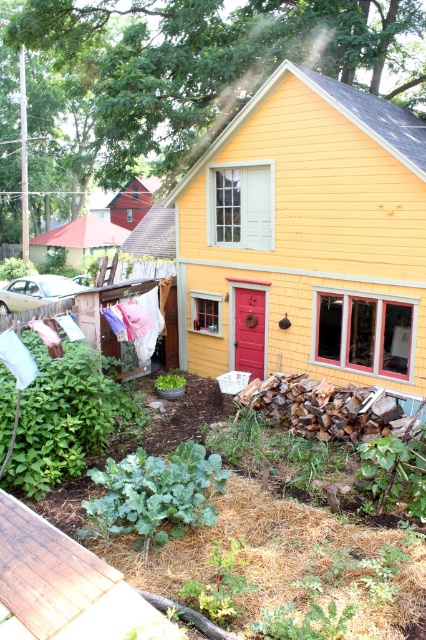
You are planning to move a 1.2 meter wide garden bench into the space between the yellow wood shed at center and the brown wooden deck at lower left. Based on the scene description, will the bench fit in that space?

The yellow wood shed at center is thinner than the brown wooden deck at lower left, so the space between them is at least as wide as the shed. Since the bench is 1.2 meters wide, it depends on the actual width of the shed. However, since the shed is thinner than the deck, the space between them might be sufficient. Without exact measurements, it is uncertain.

You are standing at the front of the house and looking towards the clothesline. There are two points marked on the image, one at coordinates point (275, 77) and another at point (31, 628). Which point is closer to you?

Point (31, 628) is closer to you because it is in front of point (275, 77).

You are a painter who needs to paint both the yellow wood shed at center and the brown wooden deck at lower left. Since you want to save time, which one should you paint first based on their size?

The yellow wood shed at center is taller than the brown wooden deck at lower left, so you should paint the yellow wood shed at center first as it requires more time due to its height.